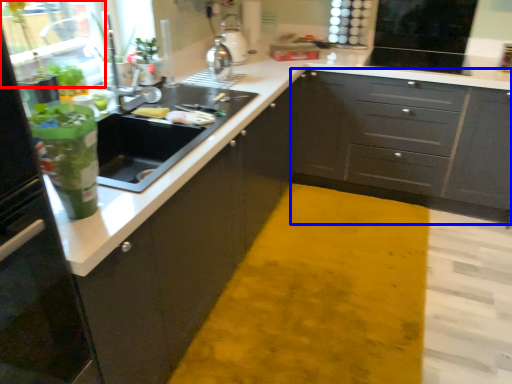
Question: Which of the following is the farthest to the observer, glass door (highlighted by a red box) or cabinetry (highlighted by a blue box)?

Choices:
 (A) glass door
 (B) cabinetry

Answer: (B)